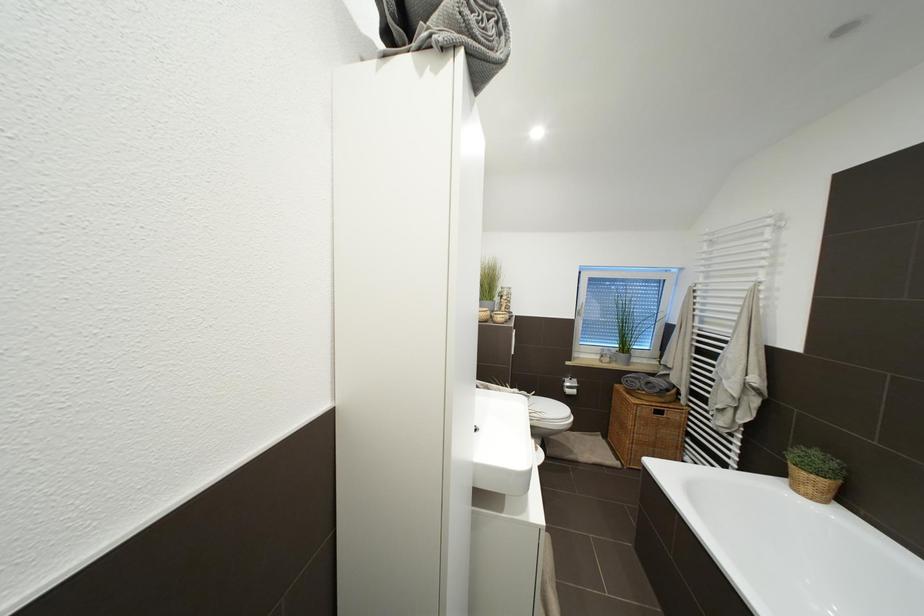
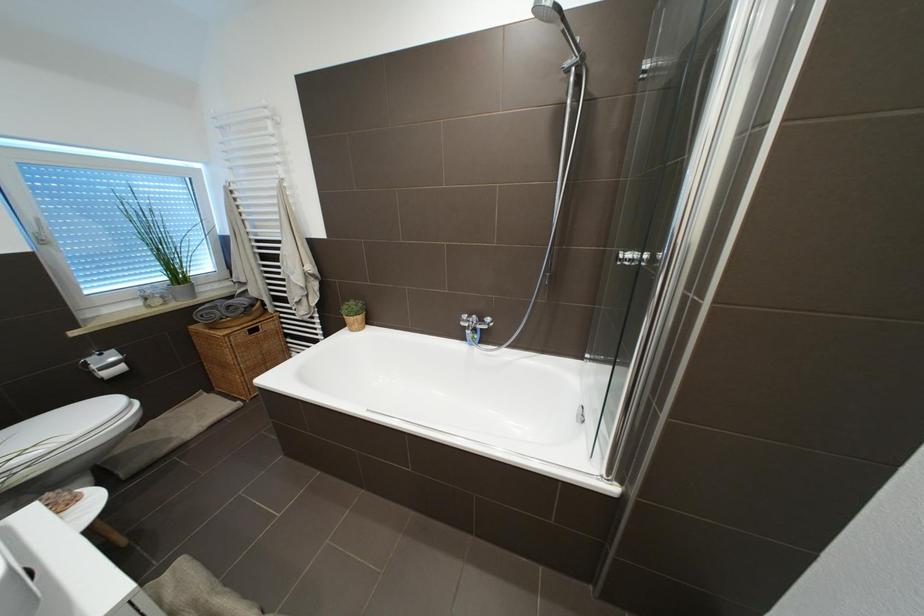
The first image is from the beginning of the video and the second image is from the end. How did the camera likely rotate when shooting the video?

The camera rotated toward right-down.